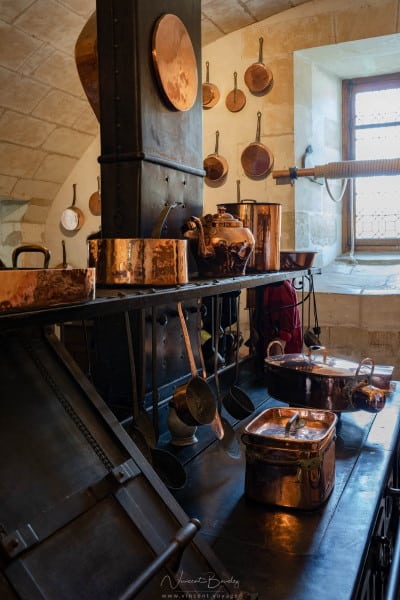
Identify the location of bottom window. The height and width of the screenshot is (600, 400). (388, 200).